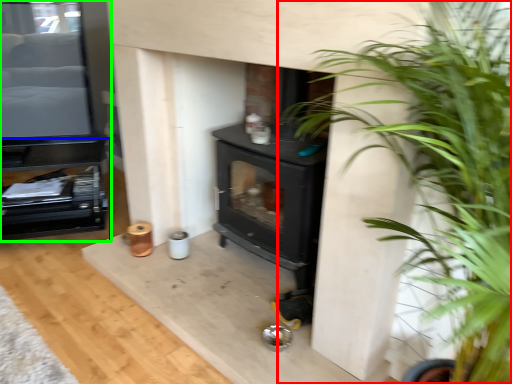
Question: Which is nearer to the houseplant (highlighted by a red box)? entertainment center (highlighted by a blue box) or entertainment center (highlighted by a green box).

Choices:
 (A) entertainment center
 (B) entertainment center

Answer: (A)